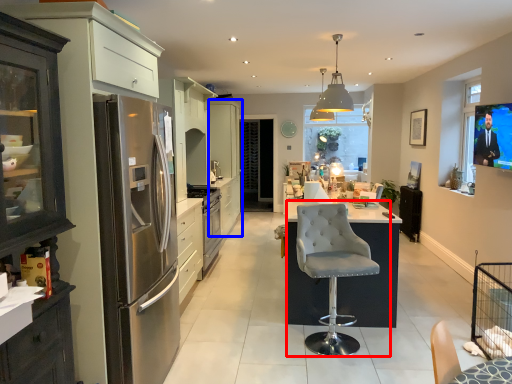
Question: Which of the following is the farthest to the observer, chair (highlighted by a red box) or cabinetry (highlighted by a blue box)?

Choices:
 (A) chair
 (B) cabinetry

Answer: (B)